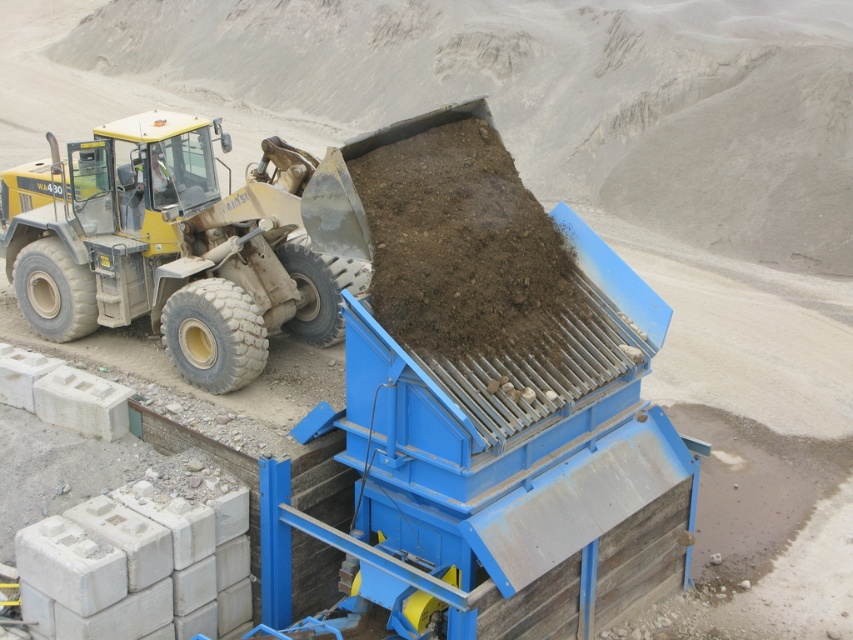
Question: Does yellow rubber tractor at left lie in front of dark brown soil at center?

Choices:
 (A) no
 (B) yes

Answer: (A)

Question: Which point is farther from the camera taking this photo?

Choices:
 (A) (88, 204)
 (B) (439, 154)

Answer: (A)

Question: Can you confirm if yellow rubber tractor at left is bigger than dark brown soil at center?

Choices:
 (A) no
 (B) yes

Answer: (A)

Question: Is yellow rubber tractor at left further to the viewer compared to dark brown soil at center?

Choices:
 (A) yes
 (B) no

Answer: (A)

Question: Which of the following is the farthest from the observer?

Choices:
 (A) dark brown soil at center
 (B) yellow rubber tractor at left

Answer: (B)